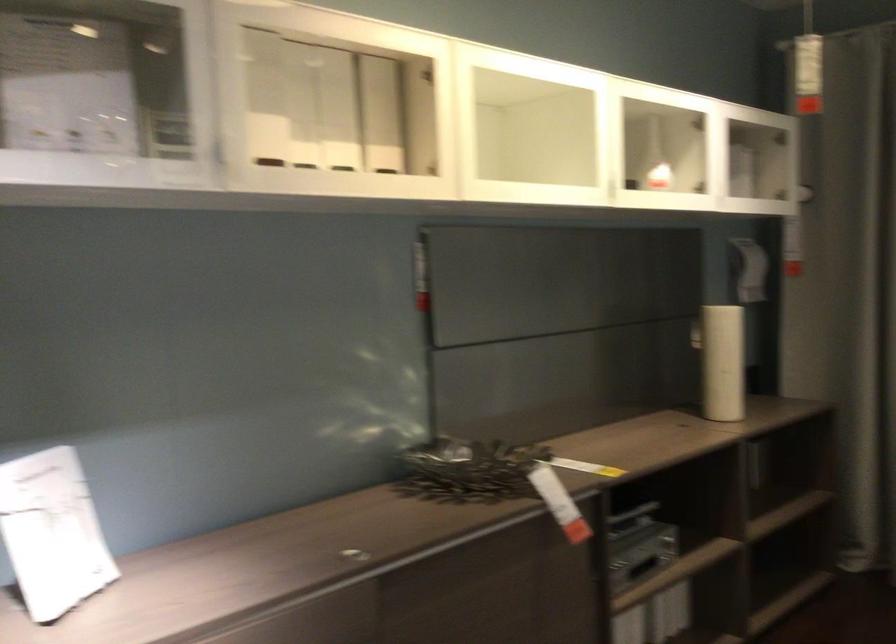
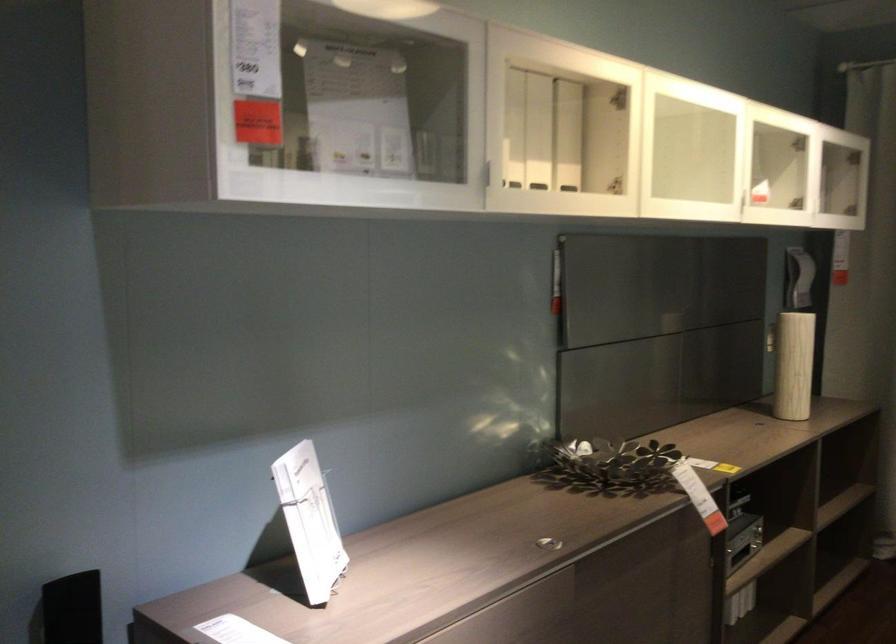
Find the pixel in the second image that matches point (226, 153) in the first image.

(487, 174)